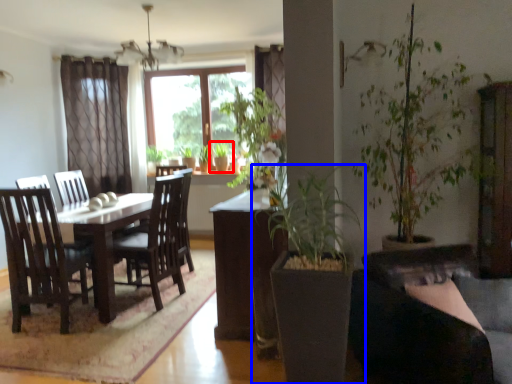
Question: Which point is further to the camera, houseplant (highlighted by a red box) or houseplant (highlighted by a blue box)?

Choices:
 (A) houseplant
 (B) houseplant

Answer: (A)